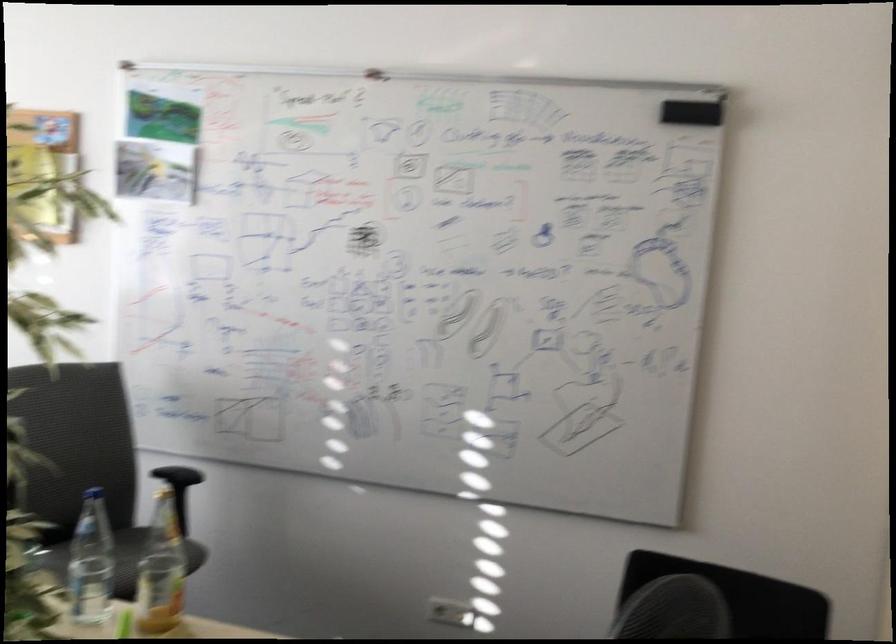
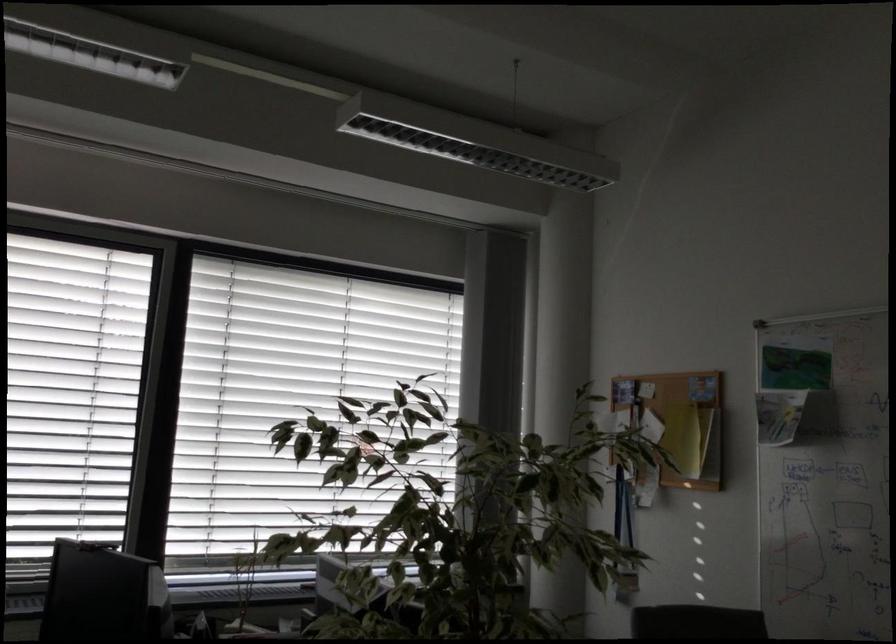
Locate, in the second image, the point that corresponds to the point at 159,295 in the first image.

(786, 538)